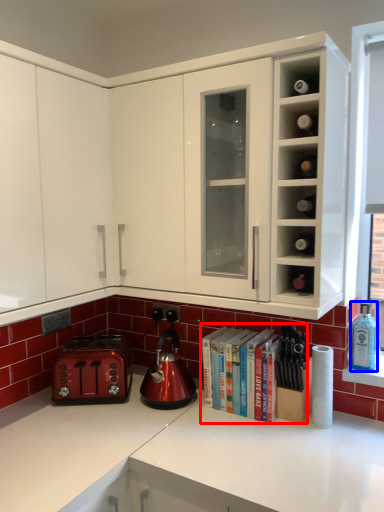
Question: Which object appears farthest to the camera in this image, book (highlighted by a red box) or bottle (highlighted by a blue box)?

Choices:
 (A) book
 (B) bottle

Answer: (B)